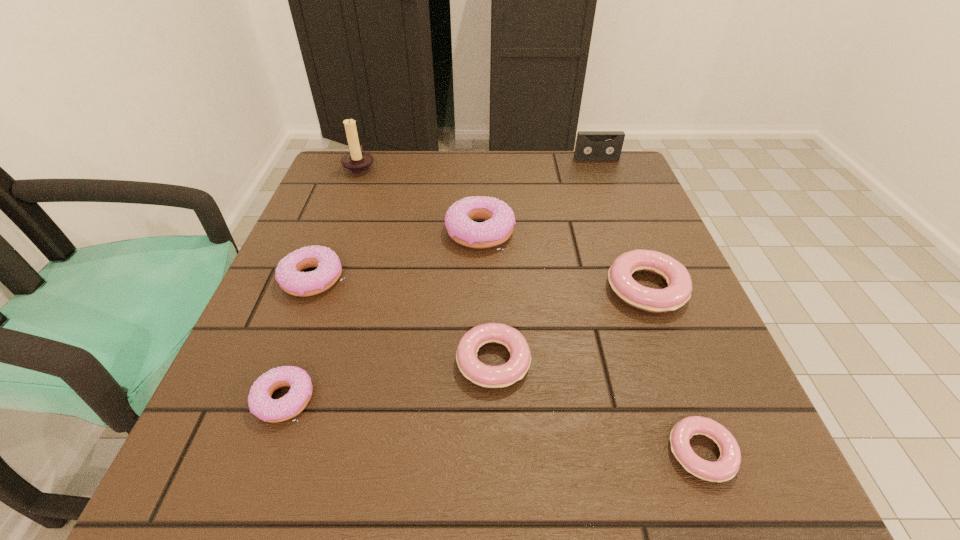
In the image, there is a desktop. Identify the location of free space at the right edge. (660, 415).

Image resolution: width=960 pixels, height=540 pixels. What are the coordinates of `free space at the far left corner` in the screenshot? It's located at (386, 150).

You are a GUI agent. You are given a task and a screenshot of the screen. Output one action in this format:
    pyautogui.click(x=<x>, y=<y>)
    Task: Click on the free region at the far right corner of the desktop
    The height and width of the screenshot is (540, 960).
    Given the screenshot: What is the action you would take?
    pyautogui.click(x=636, y=193)

This screenshot has height=540, width=960. I want to click on vacant region between the biggest pink doughnut and the second biggest pink doughnut, so click(570, 325).

The height and width of the screenshot is (540, 960). I want to click on empty space that is in between the third tallest object and the farthest pink doughnut, so click(x=564, y=260).

Find the location of a particular element. Image resolution: width=960 pixels, height=540 pixels. vacant space in between the leftmost pink doughnut and the videotape is located at coordinates (545, 260).

You are a GUI agent. You are given a task and a screenshot of the screen. Output one action in this format:
    pyautogui.click(x=<x>, y=<y>)
    Task: Click on the vacant space in between the nearest purple doughnut and the seventh shortest object
    The image size is (960, 540).
    Given the screenshot: What is the action you would take?
    pyautogui.click(x=441, y=279)

Image resolution: width=960 pixels, height=540 pixels. Find the location of `vacant space that is in between the third tallest object and the seventh shortest object`. vacant space that is in between the third tallest object and the seventh shortest object is located at coordinates (539, 195).

You are a GUI agent. You are given a task and a screenshot of the screen. Output one action in this format:
    pyautogui.click(x=<x>, y=<y>)
    Task: Click on the free space between the shortest object and the brown candle holder
    
    Given the screenshot: What is the action you would take?
    pyautogui.click(x=531, y=309)

The height and width of the screenshot is (540, 960). I want to click on free space between the farthest doughnut and the videotape, so click(539, 195).